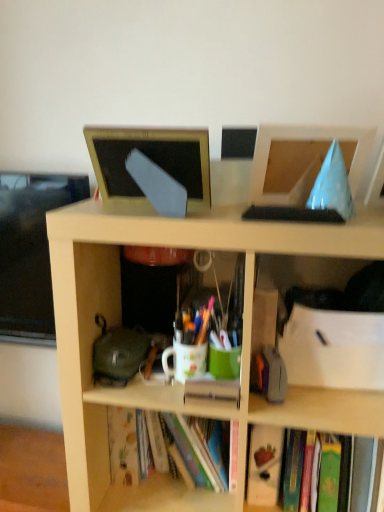
At what (x,y) coordinates should I click in order to perform the action: click on blue paper cone at upper right, the 2th computer monitor in the left-to-right sequence. Please return your answer as a coordinate pair (x, y). The height and width of the screenshot is (512, 384). Looking at the image, I should click on (302, 160).

Identify the location of hardcover book at lower right. (361, 474).

This screenshot has width=384, height=512. What do you see at coordinates (151, 160) in the screenshot?
I see `matte gold frame at upper center, the 2th computer monitor viewed from the right` at bounding box center [151, 160].

Where is `blue paper cone at upper right, the 2th computer monitor in the left-to-right sequence`? The image size is (384, 512). blue paper cone at upper right, the 2th computer monitor in the left-to-right sequence is located at coordinates (302, 160).

From a real-world perspective, between blue paper cone at upper right, marked as the 1th computer monitor in a right-to-left arrangement, and translucent plastic pen at center, who is vertically lower?

translucent plastic pen at center.

Which of these two, blue paper cone at upper right, the 2th computer monitor in the left-to-right sequence, or translucent plastic pen at center, stands shorter?

Standing shorter between the two is translucent plastic pen at center.

How distant is blue paper cone at upper right, marked as the 1th computer monitor in a right-to-left arrangement, from translucent plastic pen at center?

blue paper cone at upper right, marked as the 1th computer monitor in a right-to-left arrangement, is 15.90 inches away from translucent plastic pen at center.

Is blue paper cone at upper right, marked as the 1th computer monitor in a right-to-left arrangement, to the left of translucent plastic pen at center from the viewer's perspective?

In fact, blue paper cone at upper right, marked as the 1th computer monitor in a right-to-left arrangement, is to the right of translucent plastic pen at center.

Looking at this image, who is smaller, blue paper cone at upper right, marked as the 1th computer monitor in a right-to-left arrangement, or matte gold frame at upper center, arranged as the 1th computer monitor when viewed from the left?

Smaller between the two is blue paper cone at upper right, marked as the 1th computer monitor in a right-to-left arrangement.

From the image's perspective, between blue paper cone at upper right, marked as the 1th computer monitor in a right-to-left arrangement, and matte gold frame at upper center, arranged as the 1th computer monitor when viewed from the left, which one is located above?

matte gold frame at upper center, arranged as the 1th computer monitor when viewed from the left, appears higher in the image.

Does point (296, 182) come farther from viewer compared to point (179, 141)?

Yes, point (296, 182) is farther from viewer.

Which object is further away from the camera taking this photo, blue paper cone at upper right, the 2th computer monitor in the left-to-right sequence, or matte gold frame at upper center, the 2th computer monitor viewed from the right?

blue paper cone at upper right, the 2th computer monitor in the left-to-right sequence, is further away from the camera.

Is hardcover book at lower right surrounded by matte gold frame at upper center, arranged as the 1th computer monitor when viewed from the left?

Actually, hardcover book at lower right is outside matte gold frame at upper center, arranged as the 1th computer monitor when viewed from the left.

In the scene shown: Considering the relative positions of matte gold frame at upper center, arranged as the 1th computer monitor when viewed from the left, and hardcover book at lower right in the image provided, is matte gold frame at upper center, arranged as the 1th computer monitor when viewed from the left, to the right of hardcover book at lower right from the viewer's perspective?

Incorrect, matte gold frame at upper center, arranged as the 1th computer monitor when viewed from the left, is not on the right side of hardcover book at lower right.

How many degrees apart are the facing directions of matte gold frame at upper center, the 2th computer monitor viewed from the right, and hardcover book at lower right?

The angular difference between matte gold frame at upper center, the 2th computer monitor viewed from the right, and hardcover book at lower right is 2.08 degrees.

Which computer monitor is the 2nd one when counting from the front of the hardcover book at lower right? Please provide its 2D coordinates.

[(151, 160)]

Looking at their sizes, would you say hardcover book at lower right is wider or thinner than translucent plastic pen at center?

Considering their sizes, hardcover book at lower right looks broader than translucent plastic pen at center.

Considering the relative positions of hardcover book at lower right and translucent plastic pen at center in the image provided, is hardcover book at lower right to the left of translucent plastic pen at center from the viewer's perspective?

No.

Is hardcover book at lower right next to translucent plastic pen at center?

hardcover book at lower right and translucent plastic pen at center are not in contact.

Is hardcover book at lower right aimed at translucent plastic pen at center?

No, hardcover book at lower right is not facing towards translucent plastic pen at center.

Is matte gold frame at upper center, arranged as the 1th computer monitor when viewed from the left, next to translucent plastic pen at center and touching it?

No, matte gold frame at upper center, arranged as the 1th computer monitor when viewed from the left, is not next to translucent plastic pen at center.

Can you confirm if matte gold frame at upper center, the 2th computer monitor viewed from the right, is thinner than translucent plastic pen at center?

No, matte gold frame at upper center, the 2th computer monitor viewed from the right, is not thinner than translucent plastic pen at center.

From a real-world perspective, is matte gold frame at upper center, arranged as the 1th computer monitor when viewed from the left, located beneath translucent plastic pen at center?

No, from a real-world perspective, matte gold frame at upper center, arranged as the 1th computer monitor when viewed from the left, is not beneath translucent plastic pen at center.

Image resolution: width=384 pixels, height=512 pixels. I want to click on stationery lying on the right of matte gold frame at upper center, the 2th computer monitor viewed from the right, so click(x=269, y=375).

Based on the photo, considering the sizes of matte gold frame at upper center, arranged as the 1th computer monitor when viewed from the left, and blue paper cone at upper right, the 2th computer monitor in the left-to-right sequence, in the image, is matte gold frame at upper center, arranged as the 1th computer monitor when viewed from the left, wider or thinner than blue paper cone at upper right, the 2th computer monitor in the left-to-right sequence,?

matte gold frame at upper center, arranged as the 1th computer monitor when viewed from the left, is wider than blue paper cone at upper right, the 2th computer monitor in the left-to-right sequence.

From a real-world perspective, between matte gold frame at upper center, arranged as the 1th computer monitor when viewed from the left, and blue paper cone at upper right, the 2th computer monitor in the left-to-right sequence, who is vertically higher?

matte gold frame at upper center, arranged as the 1th computer monitor when viewed from the left.

Does point (195, 179) come farther from viewer compared to point (296, 180)?

No, it is not.

Is matte gold frame at upper center, the 2th computer monitor viewed from the right, to the left or to the right of blue paper cone at upper right, the 2th computer monitor in the left-to-right sequence, in the image?

Based on their positions, matte gold frame at upper center, the 2th computer monitor viewed from the right, is located to the left of blue paper cone at upper right, the 2th computer monitor in the left-to-right sequence.

From the image's perspective, does translucent plastic pen at center appear lower than matte gold frame at upper center, the 2th computer monitor viewed from the right?

Yes, from the image's perspective, translucent plastic pen at center is beneath matte gold frame at upper center, the 2th computer monitor viewed from the right.

How different are the orientations of translucent plastic pen at center and matte gold frame at upper center, the 2th computer monitor viewed from the right, in degrees?

The facing directions of translucent plastic pen at center and matte gold frame at upper center, the 2th computer monitor viewed from the right, are 1.79 degrees apart.

Is the surface of translucent plastic pen at center in direct contact with matte gold frame at upper center, the 2th computer monitor viewed from the right?

translucent plastic pen at center is not next to matte gold frame at upper center, the 2th computer monitor viewed from the right, and they're not touching.

Is translucent plastic pen at center smaller than matte gold frame at upper center, the 2th computer monitor viewed from the right?

Indeed, translucent plastic pen at center has a smaller size compared to matte gold frame at upper center, the 2th computer monitor viewed from the right.

The width and height of the screenshot is (384, 512). I want to click on computer monitor that is the 1st one when counting upward from the translucent plastic pen at center (from the image's perspective), so (x=302, y=160).

Locate an element on the screen. The image size is (384, 512). computer monitor located on the left of blue paper cone at upper right, the 2th computer monitor in the left-to-right sequence is located at coordinates (151, 160).

Based on their spatial positions, is matte gold frame at upper center, the 2th computer monitor viewed from the right, or hardcover book at lower right closer to blue paper cone at upper right, marked as the 1th computer monitor in a right-to-left arrangement?

Based on the image, matte gold frame at upper center, the 2th computer monitor viewed from the right, appears to be nearer to blue paper cone at upper right, marked as the 1th computer monitor in a right-to-left arrangement.

Based on their spatial positions, is matte gold frame at upper center, arranged as the 1th computer monitor when viewed from the left, or blue paper cone at upper right, the 2th computer monitor in the left-to-right sequence, further from hardcover book at lower right?

Based on the image, matte gold frame at upper center, arranged as the 1th computer monitor when viewed from the left, appears to be further to hardcover book at lower right.

From the image, which object appears to be farther from translucent plastic pen at center, hardcover book at lower right or blue paper cone at upper right, marked as the 1th computer monitor in a right-to-left arrangement?

blue paper cone at upper right, marked as the 1th computer monitor in a right-to-left arrangement, is positioned further to the anchor translucent plastic pen at center.

Consider the image. Considering their positions, is translucent plastic pen at center positioned closer to blue paper cone at upper right, marked as the 1th computer monitor in a right-to-left arrangement, than hardcover book at lower right?

The object closer to blue paper cone at upper right, marked as the 1th computer monitor in a right-to-left arrangement, is translucent plastic pen at center.

Estimate the real-world distances between objects in this image. Which object is further from matte gold frame at upper center, the 2th computer monitor viewed from the right, hardcover book at lower right or blue paper cone at upper right, the 2th computer monitor in the left-to-right sequence?

hardcover book at lower right is positioned further to the anchor matte gold frame at upper center, the 2th computer monitor viewed from the right.

From the picture: Based on their spatial positions, is hardcover book at lower right or translucent plastic pen at center further from matte gold frame at upper center, arranged as the 1th computer monitor when viewed from the left?

hardcover book at lower right is positioned further to the anchor matte gold frame at upper center, arranged as the 1th computer monitor when viewed from the left.

Estimate the real-world distances between objects in this image. Which object is further from hardcover book at lower right, translucent plastic pen at center or matte gold frame at upper center, arranged as the 1th computer monitor when viewed from the left?

matte gold frame at upper center, arranged as the 1th computer monitor when viewed from the left.

Considering their positions, is matte gold frame at upper center, arranged as the 1th computer monitor when viewed from the left, positioned further to translucent plastic pen at center than blue paper cone at upper right, marked as the 1th computer monitor in a right-to-left arrangement?

Based on the image, matte gold frame at upper center, arranged as the 1th computer monitor when viewed from the left, appears to be further to translucent plastic pen at center.

Where is `stationery between matte gold frame at upper center, the 2th computer monitor viewed from the right, and hardcover book at lower right, in the vertical direction`? This screenshot has width=384, height=512. stationery between matte gold frame at upper center, the 2th computer monitor viewed from the right, and hardcover book at lower right, in the vertical direction is located at coordinates (269, 375).

You are a GUI agent. You are given a task and a screenshot of the screen. Output one action in this format:
    pyautogui.click(x=<x>, y=<y>)
    Task: Click on the computer monitor between matte gold frame at upper center, the 2th computer monitor viewed from the right, and translucent plastic pen at center from top to bottom
    
    Given the screenshot: What is the action you would take?
    pyautogui.click(x=302, y=160)

This screenshot has width=384, height=512. I want to click on computer monitor that lies between matte gold frame at upper center, arranged as the 1th computer monitor when viewed from the left, and hardcover book at lower right from top to bottom, so click(302, 160).

What are the coordinates of `stationery that lies between blue paper cone at upper right, marked as the 1th computer monitor in a right-to-left arrangement, and hardcover book at lower right from top to bottom` in the screenshot? It's located at (269, 375).